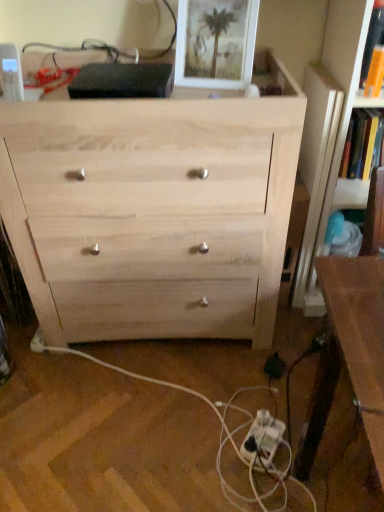
Identify the location of blank space to the left of black plastic electric outlet at lower right. [229, 374].